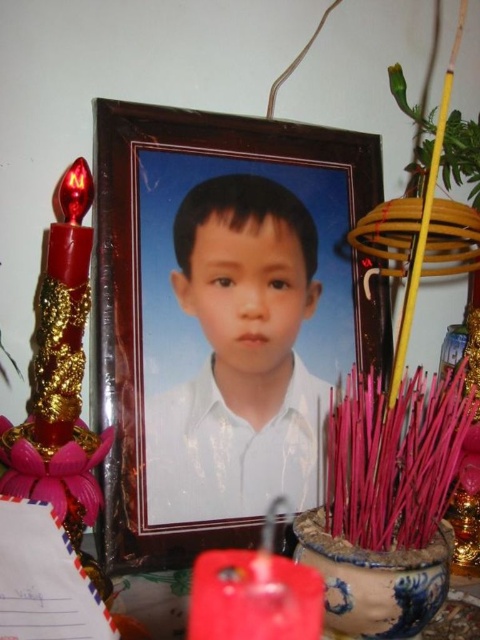
Does blue ceramic pot at center have a greater height compared to shiny gold candle at left?

No.

Is point (347, 582) farther from viewer compared to point (72, 362)?

No, it is not.

This screenshot has width=480, height=640. In order to click on blue ceramic pot at center in this screenshot , I will do `click(374, 580)`.

Is point (385, 296) closer to viewer compared to point (222, 204)?

No, (385, 296) is behind (222, 204).

Between point (242, 396) and point (188, 470), which one is positioned in front?

Point (188, 470) is more forward.

Locate an element on the screen. The width and height of the screenshot is (480, 640). wooden frame at center is located at coordinates (223, 320).

Find the location of a particular element. wooden frame at center is located at coordinates (223, 320).

Can you confirm if wooden frame at center is wider than matte red candle at lower center?

Yes, wooden frame at center is wider than matte red candle at lower center.

Describe the element at coordinates (223, 320) in the screenshot. I see `wooden frame at center` at that location.

I want to click on wooden frame at center, so click(x=223, y=320).